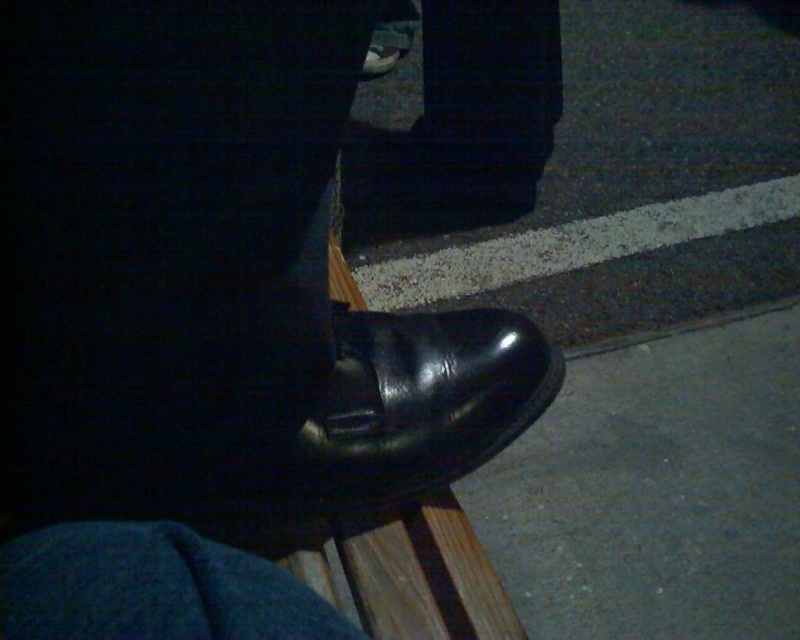
Measure the distance between shiny black shoe at center and camera.

shiny black shoe at center is 22.63 centimeters away from camera.

How far apart are shiny black shoe at center and black leather shoe at center?

shiny black shoe at center and black leather shoe at center are 2.79 inches apart from each other.

Is point (32, 435) in front of point (526, 371)?

Yes, it is in front of point (526, 371).

The height and width of the screenshot is (640, 800). In order to click on shiny black shoe at center in this screenshot , I will do `click(212, 276)`.

Is shiny black shoe at center smaller than black rubber shoe at lower right?

Correct, shiny black shoe at center occupies less space than black rubber shoe at lower right.

Is point (250, 112) farther from viewer compared to point (652, 364)?

No, it is not.

Identify the location of shiny black shoe at center. The image size is (800, 640). (212, 276).

Is black rubber shoe at lower right below black leather shoe at center?

Yes.

Is black rubber shoe at lower right bigger than black leather shoe at center?

Correct, black rubber shoe at lower right is larger in size than black leather shoe at center.

Find the location of a particular element. Image resolution: width=800 pixels, height=640 pixels. black rubber shoe at lower right is located at coordinates (656, 492).